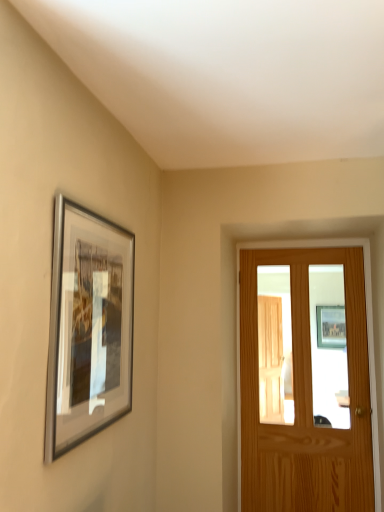
Find the location of a particular element. The width and height of the screenshot is (384, 512). silver metallic picture frame at upper left is located at coordinates (88, 327).

This screenshot has height=512, width=384. Describe the element at coordinates (88, 327) in the screenshot. I see `silver metallic picture frame at upper left` at that location.

I want to click on light brown wooden door at right, so click(367, 336).

This screenshot has width=384, height=512. Describe the element at coordinates (367, 336) in the screenshot. I see `light brown wooden door at right` at that location.

Image resolution: width=384 pixels, height=512 pixels. What are the coordinates of `silver metallic picture frame at upper left` in the screenshot? It's located at (88, 327).

Consider the image. Visually, is light brown wooden door at right positioned to the left or to the right of silver metallic picture frame at upper left?

In the image, light brown wooden door at right appears on the right side of silver metallic picture frame at upper left.

Is light brown wooden door at right further to camera compared to silver metallic picture frame at upper left?

Yes, the depth of light brown wooden door at right is greater than that of silver metallic picture frame at upper left.

Which is behind, point (373, 406) or point (116, 402)?

Positioned behind is point (373, 406).

From the image's perspective, does light brown wooden door at right appear lower than silver metallic picture frame at upper left?

Yes, from the image's perspective, light brown wooden door at right is below silver metallic picture frame at upper left.

From a real-world perspective, relative to silver metallic picture frame at upper left, is light brown wooden door at right vertically above or below?

light brown wooden door at right is situated lower than silver metallic picture frame at upper left in the real world.

Considering the sizes of light brown wooden door at right and silver metallic picture frame at upper left in the image, is light brown wooden door at right wider or thinner than silver metallic picture frame at upper left?

Considering their sizes, light brown wooden door at right looks broader than silver metallic picture frame at upper left.

Does light brown wooden door at right have a lesser height compared to silver metallic picture frame at upper left?

Incorrect, the height of light brown wooden door at right does not fall short of that of silver metallic picture frame at upper left.

Which of these two, light brown wooden door at right or silver metallic picture frame at upper left, is smaller?

silver metallic picture frame at upper left.

Does light brown wooden door at right contain silver metallic picture frame at upper left?

No, silver metallic picture frame at upper left is not a part of light brown wooden door at right.

Would you consider light brown wooden door at right to be distant from silver metallic picture frame at upper left?

Yes, light brown wooden door at right and silver metallic picture frame at upper left are located far from each other.

Is light brown wooden door at right looking in the opposite direction of silver metallic picture frame at upper left?

No.

Find the location of a particular element. picture frame above the light brown wooden door at right (from a real-world perspective) is located at coordinates (88, 327).

Can you confirm if silver metallic picture frame at upper left is positioned to the right of light brown wooden door at right?

No, silver metallic picture frame at upper left is not to the right of light brown wooden door at right.

Considering their positions, is silver metallic picture frame at upper left located in front of or behind light brown wooden door at right?

silver metallic picture frame at upper left is in front of light brown wooden door at right.

Is point (94, 352) closer or farther from the camera than point (335, 247)?

Point (94, 352) appears to be closer to the viewer than point (335, 247).

From the image's perspective, which is below, silver metallic picture frame at upper left or light brown wooden door at right?

light brown wooden door at right is shown below in the image.

From a real-world perspective, is silver metallic picture frame at upper left below light brown wooden door at right?

No, from a real-world perspective, silver metallic picture frame at upper left is not under light brown wooden door at right.

Which of these two, silver metallic picture frame at upper left or light brown wooden door at right, is wider?

light brown wooden door at right is wider.

Who is taller, silver metallic picture frame at upper left or light brown wooden door at right?

light brown wooden door at right.

Can you confirm if silver metallic picture frame at upper left is bigger than light brown wooden door at right?

No.

Is light brown wooden door at right inside silver metallic picture frame at upper left?

No, light brown wooden door at right is not surrounded by silver metallic picture frame at upper left.

Are silver metallic picture frame at upper left and light brown wooden door at right located far from each other?

silver metallic picture frame at upper left is far away from light brown wooden door at right.

Based on the photo, could you tell me if silver metallic picture frame at upper left is facing light brown wooden door at right?

No, silver metallic picture frame at upper left is not facing towards light brown wooden door at right.

Locate an element on the screen. This screenshot has height=512, width=384. door located below the silver metallic picture frame at upper left (from the image's perspective) is located at coordinates tap(367, 336).

This screenshot has width=384, height=512. In order to click on picture frame that is above the light brown wooden door at right (from the image's perspective) in this screenshot , I will do `click(88, 327)`.

You are a GUI agent. You are given a task and a screenshot of the screen. Output one action in this format:
    pyautogui.click(x=<x>, y=<y>)
    Task: Click on the picture frame that is on the left side of light brown wooden door at right
    This screenshot has height=512, width=384.
    Given the screenshot: What is the action you would take?
    pyautogui.click(x=88, y=327)